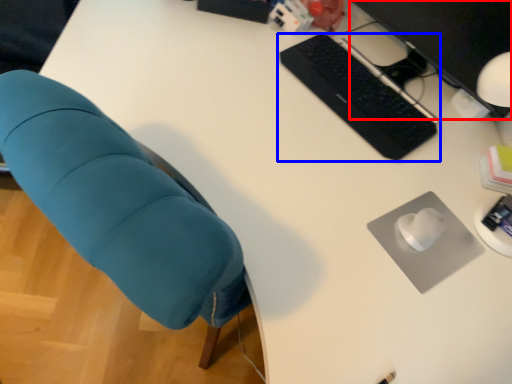
Question: Which point is further to the camera, computer monitor (highlighted by a red box) or computer keyboard (highlighted by a blue box)?

Choices:
 (A) computer monitor
 (B) computer keyboard

Answer: (B)